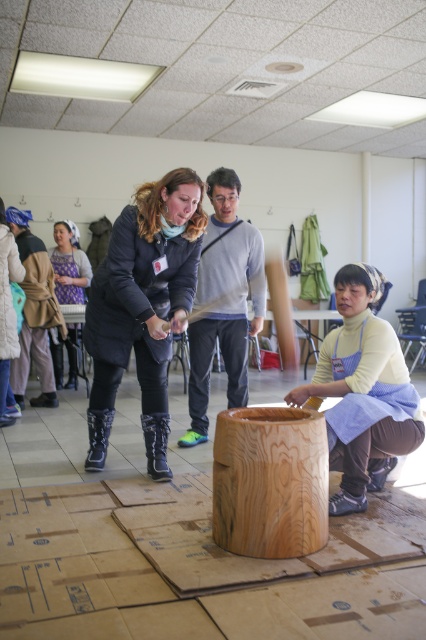
You are a participant in the workshop and need to place a 10cm tall object on the surface between the matte black jacket at center and the natural wood cylinder at center. Which object should you place it next to to ensure it doesn

The matte black jacket at center is taller than the natural wood cylinder at center, so placing the 10cm tall object next to the natural wood cylinder at center would provide a more stable and level surface since the cylinder is shorter and closer in height to the object.